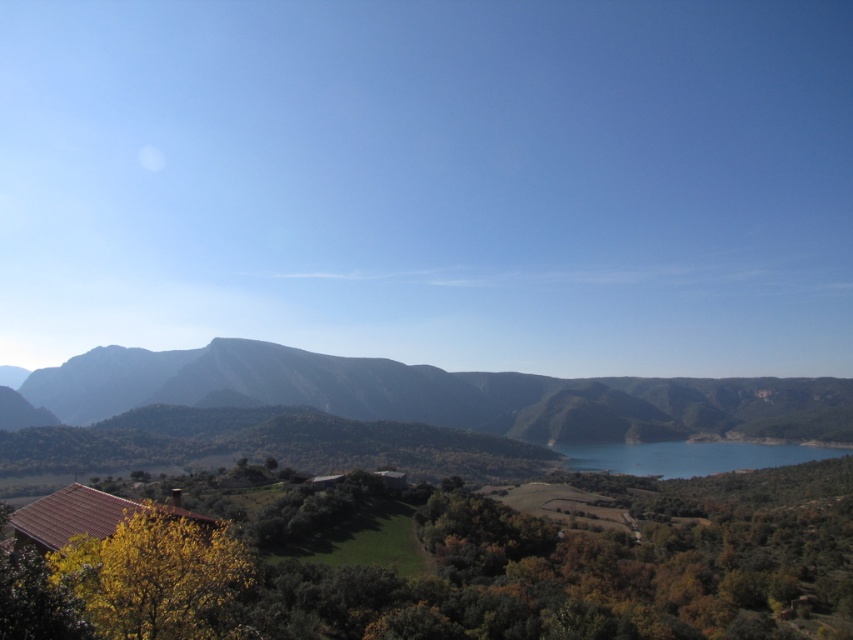
Question: Is rocky gray mountains at center above blue glassy lake at center?

Choices:
 (A) yes
 (B) no

Answer: (A)

Question: Does rocky gray mountains at center appear on the left side of blue glassy lake at center?

Choices:
 (A) no
 (B) yes

Answer: (B)

Question: Is rocky gray mountains at center wider than blue glassy lake at center?

Choices:
 (A) no
 (B) yes

Answer: (B)

Question: Which object is closer to the camera taking this photo?

Choices:
 (A) blue glassy lake at center
 (B) rocky gray mountains at center

Answer: (B)

Question: Which of the following is the farthest from the observer?

Choices:
 (A) rocky gray mountains at center
 (B) blue glassy lake at center

Answer: (B)